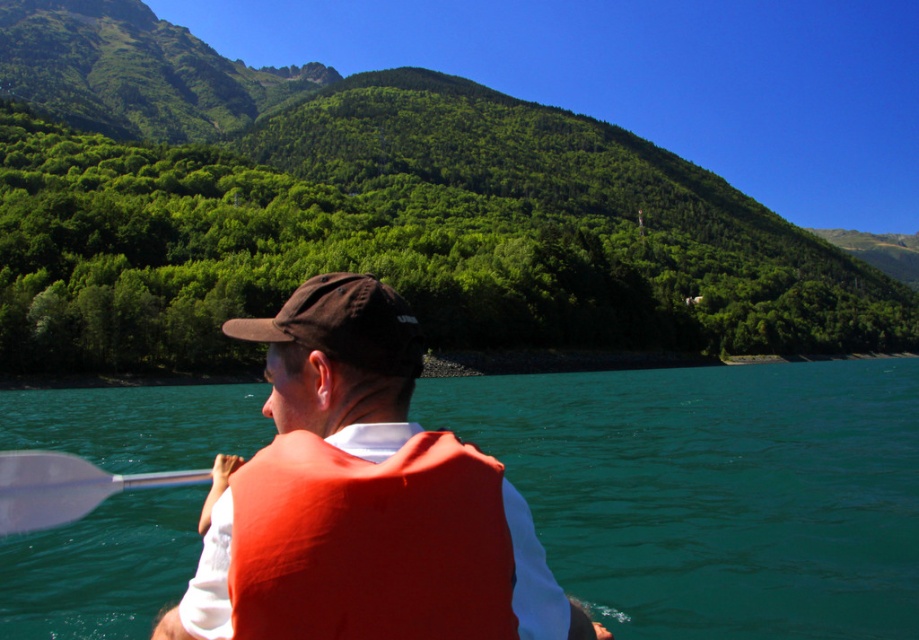
Who is more forward, (506, 156) or (357, 356)?

Positioned in front is point (357, 356).

Can you confirm if green forested mountain at upper center is bigger than brown fabric baseball cap at center?

Correct, green forested mountain at upper center is larger in size than brown fabric baseball cap at center.

Between point (176, 273) and point (295, 310), which one is positioned in front?

Point (295, 310)

Locate an element on the screen. green forested mountain at upper center is located at coordinates (367, 211).

In order to click on green forested mountain at upper center in this screenshot , I will do `click(367, 211)`.

Where is `green forested mountain at upper center`? The image size is (919, 640). green forested mountain at upper center is located at coordinates (367, 211).

Does orange life vest at center come behind brown fabric baseball cap at center?

No.

Between point (167, 632) and point (310, 314), which one is positioned behind?

The point (310, 314) is behind.

I want to click on orange life vest at center, so [362, 499].